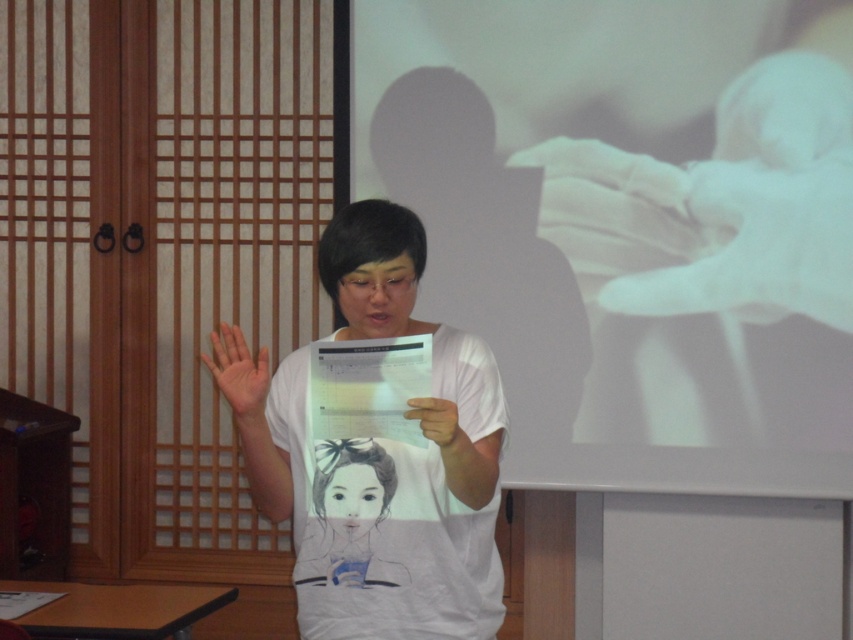
Question: Which object appears closest to the camera in this image?

Choices:
 (A) white matte paper at center
 (B) matte white hand at center
 (C) white matte t-shirt at center

Answer: (A)

Question: Is white matte projection screen at upper center to the left of white matte paper at center from the viewer's perspective?

Choices:
 (A) no
 (B) yes

Answer: (A)

Question: Which is nearer to the white matte t-shirt at center?

Choices:
 (A) matte white hand at center
 (B) white matte paper at center
 (C) white matte projection screen at upper center

Answer: (B)

Question: Among these objects, which one is farthest from the camera?

Choices:
 (A) white matte projection screen at upper center
 (B) matte white hand at center
 (C) white matte t-shirt at center

Answer: (A)

Question: Can you confirm if white matte projection screen at upper center is positioned to the right of matte white hand at center?

Choices:
 (A) yes
 (B) no

Answer: (A)

Question: Is matte white hand at center bigger than white matte paper at center?

Choices:
 (A) yes
 (B) no

Answer: (A)